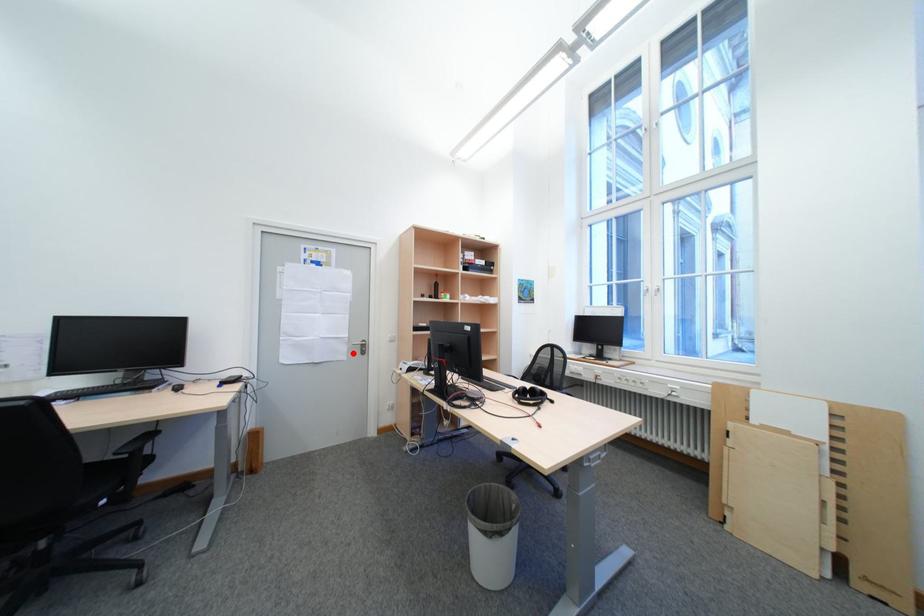
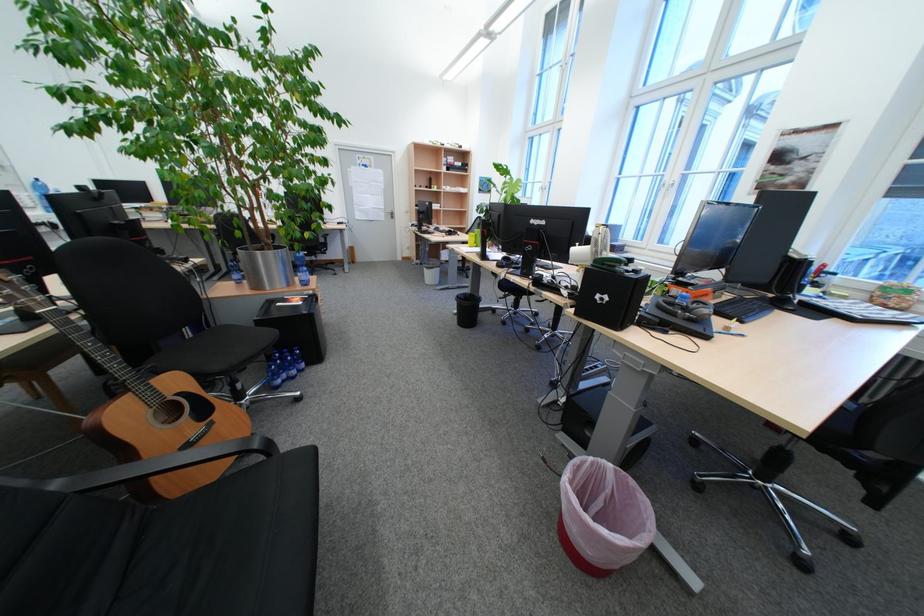
Question: A red point is marked in image1. In image2, is the corresponding 3D point closer to the camera or farther? Reply with the corresponding letter.

Choices:
 (A) The corresponding 3D point is closer.
 (B) The corresponding 3D point is farther.

Answer: (A)